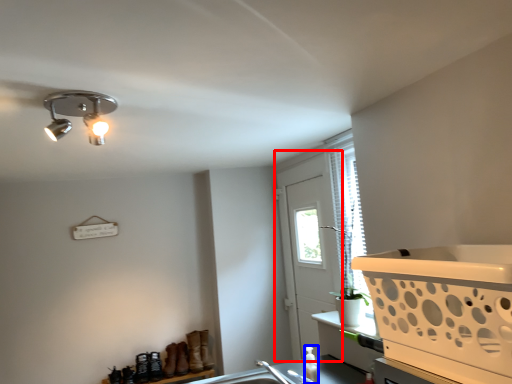
Question: Which point is closer to the camera, screen door (highlighted by a red box) or bottle (highlighted by a blue box)?

Choices:
 (A) screen door
 (B) bottle

Answer: (B)